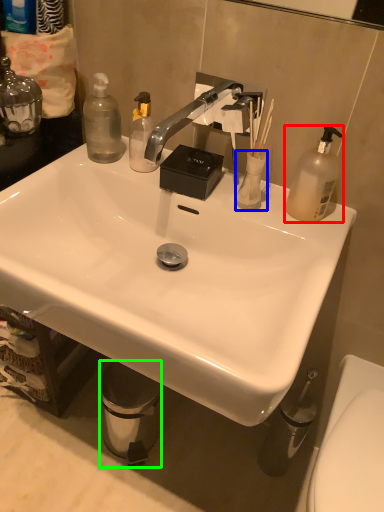
Question: Considering the real-world distances, which object is farthest from bottle (highlighted by a red box)? toiletries (highlighted by a blue box) or trash bin/can (highlighted by a green box)?

Choices:
 (A) toiletries
 (B) trash bin/can

Answer: (B)